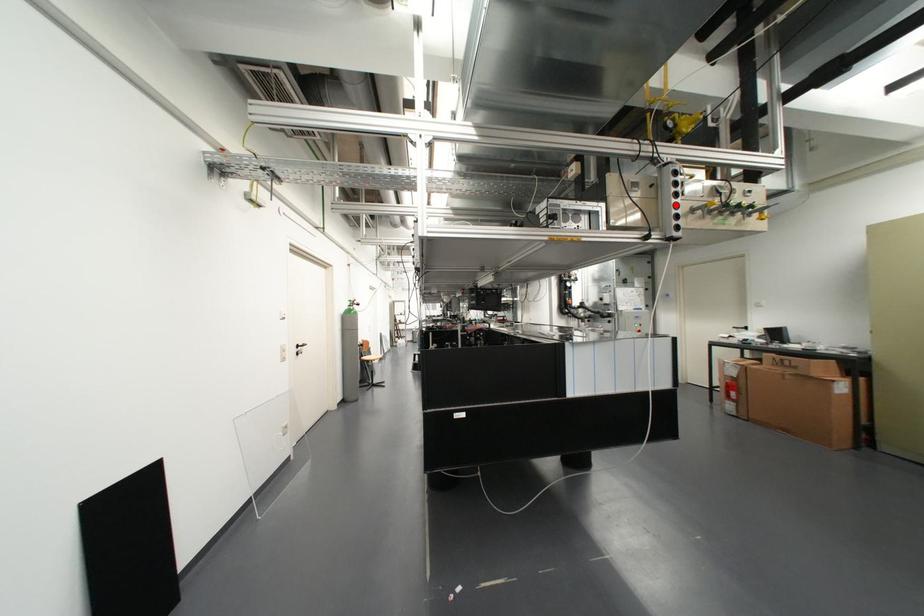
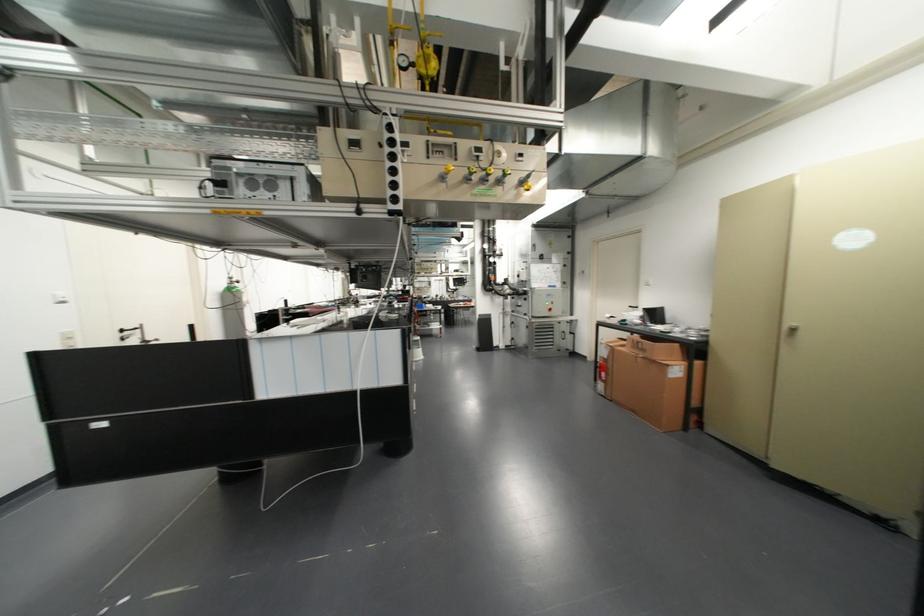
Where in the second image is the point corresponding to the highlighted location from the first image?

(393, 171)